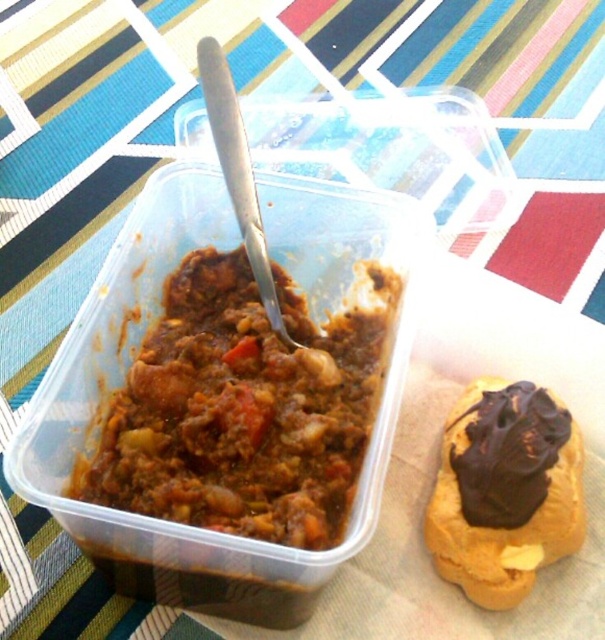
Is brown matte stew at center thinner than chocolate-frosted pastry at center?

No.

Is brown matte stew at center further to the viewer compared to chocolate-frosted pastry at center?

That is False.

The height and width of the screenshot is (640, 605). I want to click on brown matte stew at center, so click(244, 406).